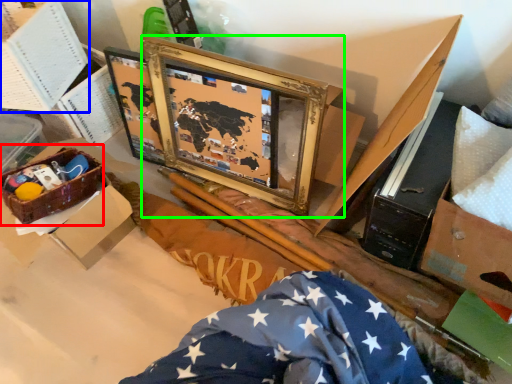
Question: Which is nearer to the crate (highlighted by a red box)? box (highlighted by a blue box) or picture frame (highlighted by a green box).

Choices:
 (A) box
 (B) picture frame

Answer: (A)